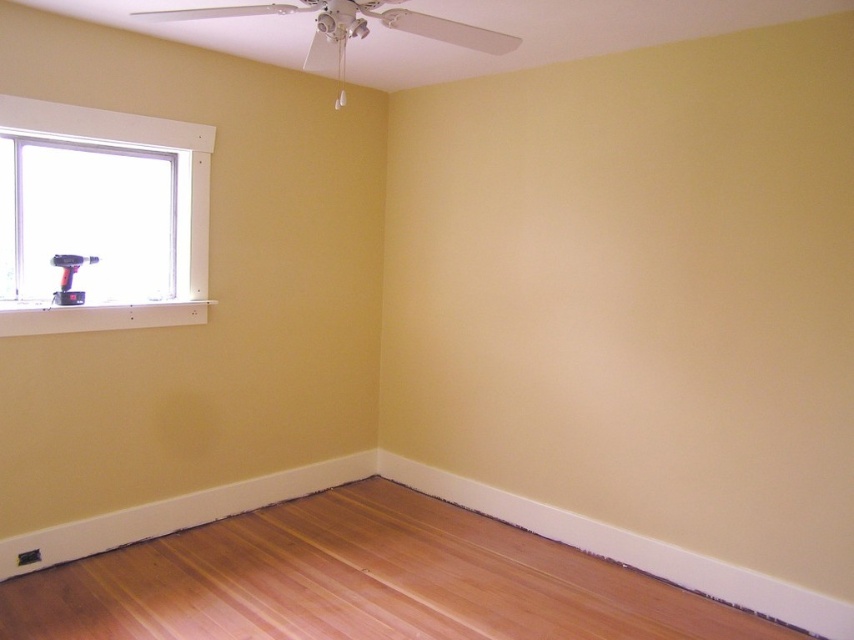
Who is more distant from viewer, (117,246) or (839,609)?

Point (117,246)

This screenshot has width=854, height=640. What do you see at coordinates (101, 218) in the screenshot? I see `white plastic window at left` at bounding box center [101, 218].

The width and height of the screenshot is (854, 640). Identify the location of white plastic window at left. [x=101, y=218].

Does white painted wood baseboard at lower right appear on the right side of matte black drill at window?

Indeed, white painted wood baseboard at lower right is positioned on the right side of matte black drill at window.

Does white painted wood baseboard at lower right have a lesser height compared to matte black drill at window?

No, white painted wood baseboard at lower right is not shorter than matte black drill at window.

Find the location of a particular element. The image size is (854, 640). white painted wood baseboard at lower right is located at coordinates (629, 548).

Find the location of `white painted wood baseboard at lower right`. white painted wood baseboard at lower right is located at coordinates (629, 548).

Consider the image. Can you confirm if natural wood flooring at lower center is thinner than white plastic window at left?

No.

What are the coordinates of `natural wood flooring at lower center` in the screenshot? It's located at (360, 582).

Is point (566, 620) in front of point (149, 252)?

Yes.

This screenshot has width=854, height=640. I want to click on natural wood flooring at lower center, so click(x=360, y=582).